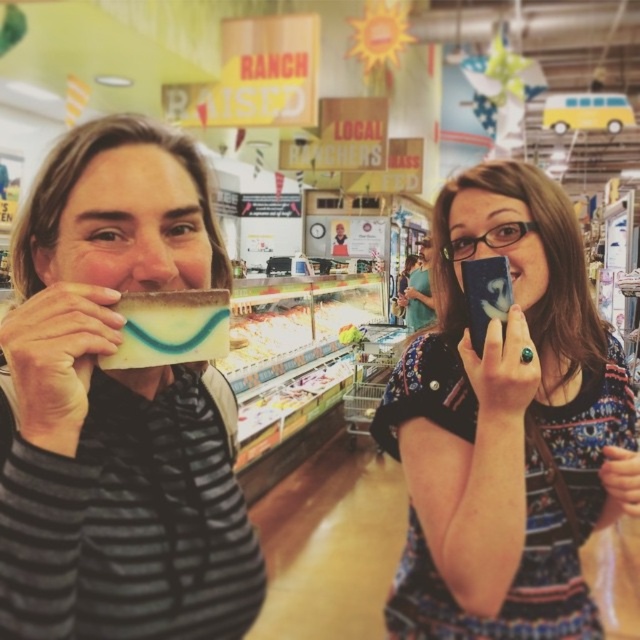
In the scene shown: Can you confirm if matte yellow cheese at left is bigger than smooth plastic container at center?

Yes, matte yellow cheese at left is bigger than smooth plastic container at center.

Can you confirm if matte yellow cheese at left is taller than smooth plastic container at center?

Yes.

The width and height of the screenshot is (640, 640). What do you see at coordinates (116, 406) in the screenshot?
I see `matte yellow cheese at left` at bounding box center [116, 406].

Locate an element on the screen. Image resolution: width=640 pixels, height=640 pixels. matte yellow cheese at left is located at coordinates (116, 406).

Which is above, matte yellow cheese at left or transparent plastic glasses at upper center?

transparent plastic glasses at upper center

Locate an element on the screen. matte yellow cheese at left is located at coordinates (116, 406).

This screenshot has width=640, height=640. What do you see at coordinates (116, 406) in the screenshot? I see `matte yellow cheese at left` at bounding box center [116, 406].

In order to click on matte yellow cheese at left in this screenshot , I will do `click(116, 406)`.

In the scene shown: How far apart are natural soap at left and smooth plastic container at center?

They are 12.63 feet apart.

Which of these two, natural soap at left or smooth plastic container at center, stands taller?

smooth plastic container at center is taller.

Does point (125, 300) come in front of point (355, 336)?

Yes.

The width and height of the screenshot is (640, 640). Find the location of `natural soap at left`. natural soap at left is located at coordinates (170, 328).